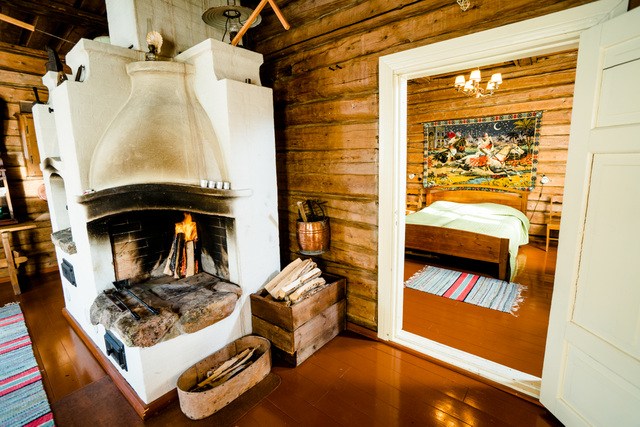
You are a GUI agent. You are given a task and a screenshot of the screen. Output one action in this format:
    pyautogui.click(x=<x>, y=<y>)
    Task: Click on the mantel
    
    Given the screenshot: What is the action you would take?
    pyautogui.click(x=182, y=185)